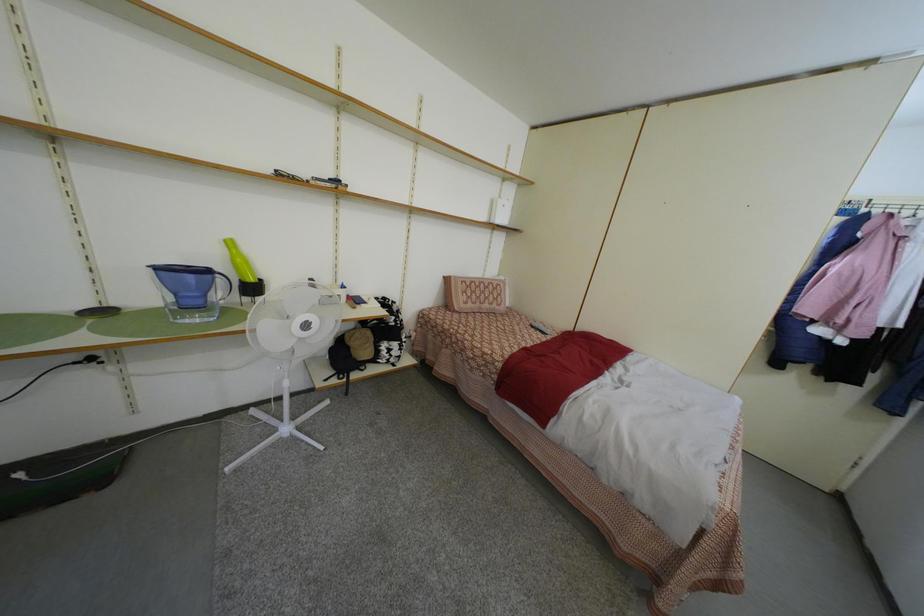
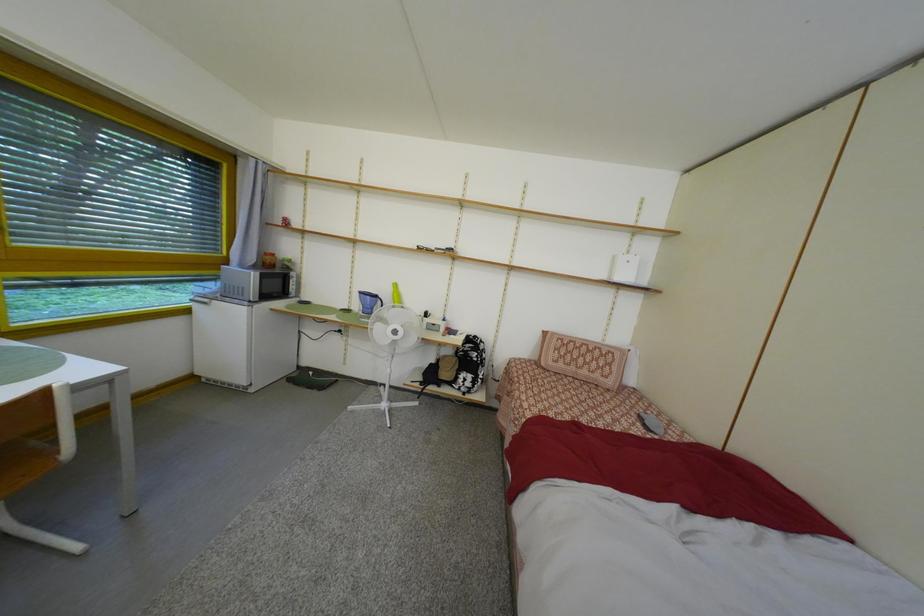
Question: The camera is either moving clockwise (left) or counter-clockwise (right) around the object. The first image is from the beginning of the video and the second image is from the end. Is the camera moving left or right when shooting the video?

Choices:
 (A) Left
 (B) Right

Answer: (B)